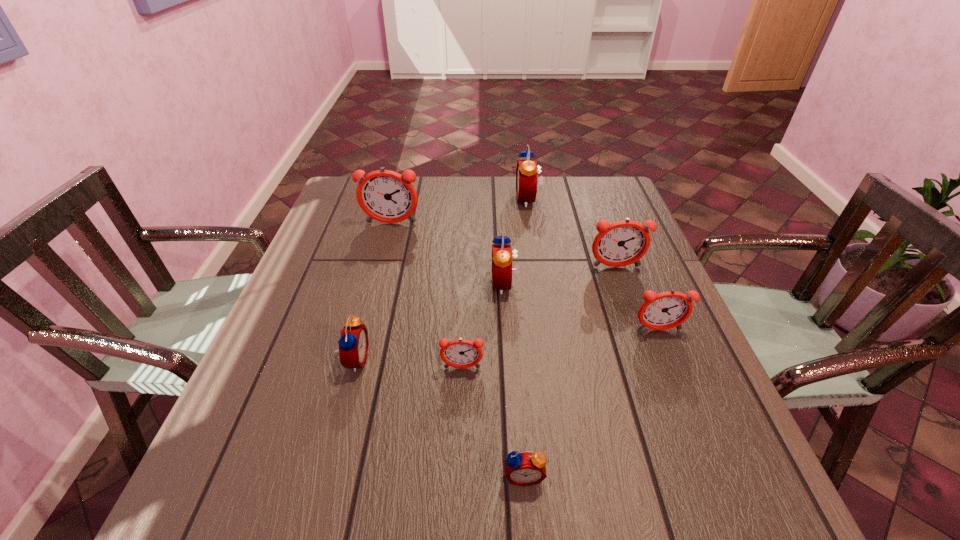
Image resolution: width=960 pixels, height=540 pixels. In order to click on the third reddish-pink alarm clock from right to left in this screenshot , I will do pyautogui.click(x=460, y=353).

Identify the location of the sixth object from right to left. The image size is (960, 540). (460, 353).

This screenshot has height=540, width=960. Identify the location of the nearest alarm clock. (525, 468).

Where is `the nearest red alarm clock`? The height and width of the screenshot is (540, 960). the nearest red alarm clock is located at coordinates (525, 468).

Where is `vacant space located 0.290m on the front-facing side of the sixth object from left to right`? Image resolution: width=960 pixels, height=540 pixels. vacant space located 0.290m on the front-facing side of the sixth object from left to right is located at coordinates (424, 200).

At what (x,y) coordinates should I click in order to perform the action: click on free spot located on the front-facing side of the sixth object from left to right. Please return your answer as a coordinate pair (x, y). Looking at the image, I should click on coord(418,200).

Locate an element on the screen. vacant space situated on the front-facing side of the sixth object from left to right is located at coordinates (475, 200).

The height and width of the screenshot is (540, 960). Find the location of `free spot located on the front-facing side of the seventh nearest object`. free spot located on the front-facing side of the seventh nearest object is located at coordinates (383, 255).

Find the location of a particular element. This screenshot has width=960, height=540. free space located 0.390m on the front-facing side of the third nearest red alarm clock is located at coordinates (334, 284).

Where is `free space located on the front-facing side of the third nearest red alarm clock`? free space located on the front-facing side of the third nearest red alarm clock is located at coordinates (343, 284).